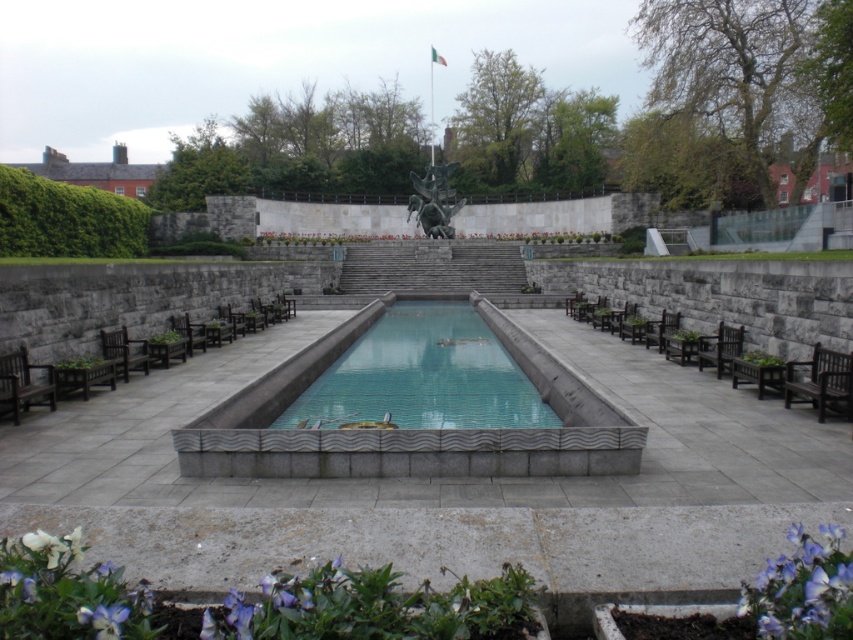
The height and width of the screenshot is (640, 853). What do you see at coordinates (804, 589) in the screenshot? I see `purple matte flower at lower right` at bounding box center [804, 589].

In the scene shown: Measure the distance between point (822, 545) and camera.

They are 9.60 feet apart.

Between point (830, 550) and point (189, 353), which one is positioned in front?

Point (830, 550) is in front.

The width and height of the screenshot is (853, 640). In order to click on purple matte flower at lower right in this screenshot , I will do `click(804, 589)`.

Can you confirm if purple matte flower at lower right is smaller than dark brown wooden bench at lower left?

Yes, purple matte flower at lower right is smaller than dark brown wooden bench at lower left.

Between point (839, 568) and point (22, 374), which one is positioned behind?

The point (22, 374) is behind.

Identify the location of purple matte flower at lower right. (804, 589).

Is purple matte flower at lower right to the right of purple matte flower at lower left from the viewer's perspective?

Correct, you'll find purple matte flower at lower right to the right of purple matte flower at lower left.

Is purple matte flower at lower right smaller than purple matte flower at lower left?

Actually, purple matte flower at lower right might be larger than purple matte flower at lower left.

This screenshot has height=640, width=853. Find the location of `purple matte flower at lower right`. purple matte flower at lower right is located at coordinates (804, 589).